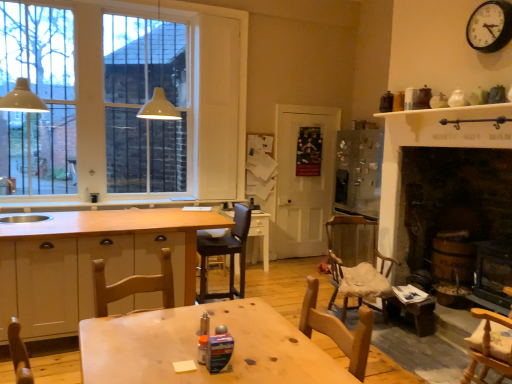
Question: Can you confirm if wooden chair with cushion at center-right, which ranks as the 2th chair in right-to-left order, is shorter than white glass window at upper left?

Choices:
 (A) no
 (B) yes

Answer: (B)

Question: Is wooden chair with cushion at center-right, arranged as the 1th chair when viewed from the back, taller than white glass window at upper left?

Choices:
 (A) no
 (B) yes

Answer: (A)

Question: Does wooden chair with cushion at center-right, placed as the 4th chair when sorted from front to back, have a greater width compared to white glass window at upper left?

Choices:
 (A) yes
 (B) no

Answer: (A)

Question: Is wooden chair with cushion at center-right, placed as the 4th chair when sorted from front to back, facing away from white glass window at upper left?

Choices:
 (A) no
 (B) yes

Answer: (A)

Question: Is wooden chair with cushion at center-right, which ranks as the 2th chair in right-to-left order, to the left of white glass window at upper left from the viewer's perspective?

Choices:
 (A) yes
 (B) no

Answer: (B)

Question: From a real-world perspective, is wooden at left physically located above or below wooden table at center, which is counted as the 2th table, starting from the back?

Choices:
 (A) below
 (B) above

Answer: (B)

Question: From the image's perspective, is wooden at left located above or below wooden table at center, which is counted as the 2th table, starting from the back?

Choices:
 (A) above
 (B) below

Answer: (A)

Question: Is wooden at left spatially inside wooden table at center, which is counted as the 2th table, starting from the back, or outside of it?

Choices:
 (A) inside
 (B) outside

Answer: (B)

Question: Is point (0, 208) closer or farther from the camera than point (205, 309)?

Choices:
 (A) closer
 (B) farther

Answer: (B)

Question: Considering the positions of point (485, 9) and point (485, 311), is point (485, 9) closer or farther from the camera than point (485, 311)?

Choices:
 (A) farther
 (B) closer

Answer: (A)

Question: From a real-world perspective, is black metallic clock at upper right above or below wooden chair at lower right, which is counted as the fourth chair, starting from the left?

Choices:
 (A) below
 (B) above

Answer: (B)

Question: From the image's perspective, is black metallic clock at upper right located above or below wooden chair at lower right, the 1th chair viewed from the right?

Choices:
 (A) above
 (B) below

Answer: (A)

Question: Based on their sizes in the image, would you say black metallic clock at upper right is bigger or smaller than wooden chair at lower right, acting as the second chair starting from the front?

Choices:
 (A) small
 (B) big

Answer: (A)

Question: From a real-world perspective, is white wood cabinetry at center positioned above or below wooden chair at lower center, positioned as the 3th chair in right-to-left order?

Choices:
 (A) above
 (B) below

Answer: (B)

Question: In terms of size, does white wood cabinetry at center appear bigger or smaller than wooden chair at lower center, positioned as the 3th chair in right-to-left order?

Choices:
 (A) big
 (B) small

Answer: (A)